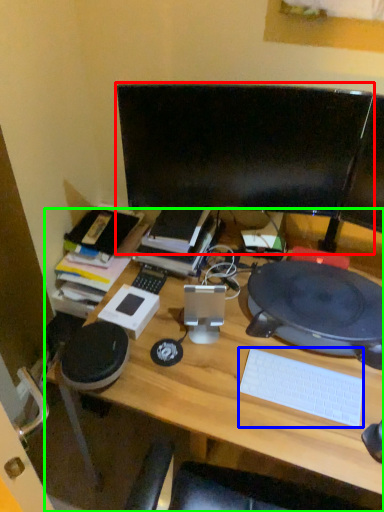
Question: Which object is the closest to the computer monitor (highlighted by a red box)? Choose among these: computer keyboard (highlighted by a blue box) or desk (highlighted by a green box).

Choices:
 (A) computer keyboard
 (B) desk

Answer: (B)